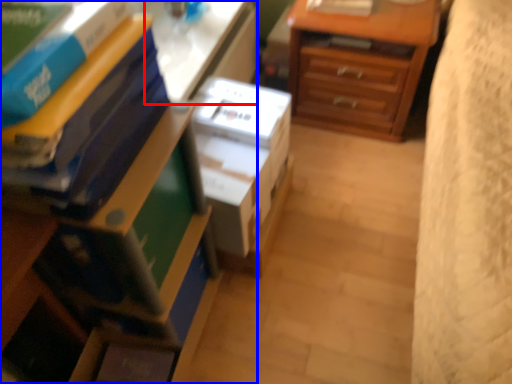
Question: Among these objects, which one is nearest to the camera, table (highlighted by a red box) or nightstand (highlighted by a blue box)?

Choices:
 (A) table
 (B) nightstand

Answer: (B)